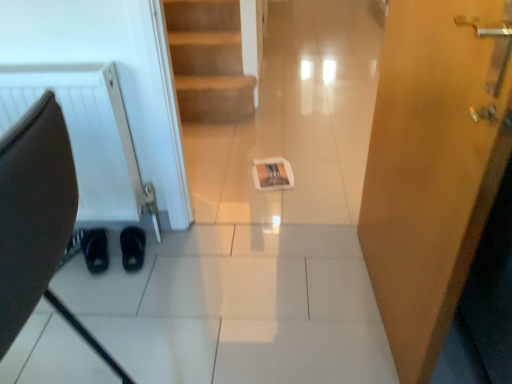
You are a GUI agent. You are given a task and a screenshot of the screen. Output one action in this format:
    pyautogui.click(x=<x>, y=<y>)
    Task: Click on the free point behind matte paper magazine at center
    This screenshot has width=512, height=384.
    Given the screenshot: What is the action you would take?
    pyautogui.click(x=270, y=152)